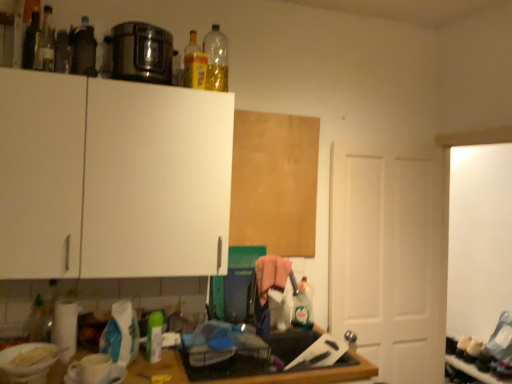
Question: Is green matte spray can at lower center, the 5th bottle viewed from the back, with white matte door at right?

Choices:
 (A) no
 (B) yes

Answer: (A)

Question: From a real-world perspective, is green matte spray can at lower center, positioned as the 4th bottle in left-to-right order, under white matte door at right?

Choices:
 (A) yes
 (B) no

Answer: (A)

Question: Is green matte spray can at lower center, the second bottle when ordered from bottom to top, bigger than white matte door at right?

Choices:
 (A) yes
 (B) no

Answer: (B)

Question: From the image's perspective, is green matte spray can at lower center, which appears as the seventh bottle when viewed from the top, over white matte door at right?

Choices:
 (A) yes
 (B) no

Answer: (B)

Question: Is green matte spray can at lower center, which appears as the seventh bottle when viewed from the top, to the left of white matte door at right from the viewer's perspective?

Choices:
 (A) no
 (B) yes

Answer: (B)

Question: Considering the positions of translucent plastic bottle at upper center, which is the sixth bottle in left-to-right order, and white plastic bowl at lower left in the image, is translucent plastic bottle at upper center, which is the sixth bottle in left-to-right order, bigger or smaller than white plastic bowl at lower left?

Choices:
 (A) big
 (B) small

Answer: (A)

Question: From their relative heights in the image, would you say translucent plastic bottle at upper center, the first bottle positioned from the top, is taller or shorter than white plastic bowl at lower left?

Choices:
 (A) tall
 (B) short

Answer: (A)

Question: Is translucent plastic bottle at upper center, the eighth bottle from the bottom, to the left or to the right of white plastic bowl at lower left in the image?

Choices:
 (A) left
 (B) right

Answer: (B)

Question: Would you say translucent plastic bottle at upper center, the eighth bottle from the bottom, is inside or outside white plastic bowl at lower left?

Choices:
 (A) inside
 (B) outside

Answer: (B)

Question: From the image's perspective, is matte black bottle at upper left, placed as the 6th bottle when sorted from back to front, positioned above or below translucent yellow bottle at upper center, the 5th bottle positioned from the top?

Choices:
 (A) above
 (B) below

Answer: (A)

Question: In the image, is matte black bottle at upper left, which appears as the sixth bottle when viewed from the right, on the left side or the right side of translucent yellow bottle at upper center, the 5th bottle positioned from the top?

Choices:
 (A) right
 (B) left

Answer: (B)

Question: In the image, is matte black bottle at upper left, the 3th bottle in the left-to-right sequence, positioned in front of or behind translucent yellow bottle at upper center, the 5th bottle positioned from the top?

Choices:
 (A) behind
 (B) front

Answer: (B)

Question: In terms of height, does matte black bottle at upper left, the 3th bottle in the left-to-right sequence, look taller or shorter compared to translucent yellow bottle at upper center, the fourth bottle ordered from the bottom?

Choices:
 (A) short
 (B) tall

Answer: (A)

Question: Is translucent yellow bottle at upper center, the 4th bottle when ordered from right to left, wider or thinner than translucent glass bottle at upper left, which is the third bottle from top to bottom?

Choices:
 (A) thin
 (B) wide

Answer: (B)

Question: Is translucent yellow bottle at upper center, the 5th bottle positioned from the top, spatially inside translucent glass bottle at upper left, the 2th bottle in the left-to-right sequence, or outside of it?

Choices:
 (A) outside
 (B) inside

Answer: (A)